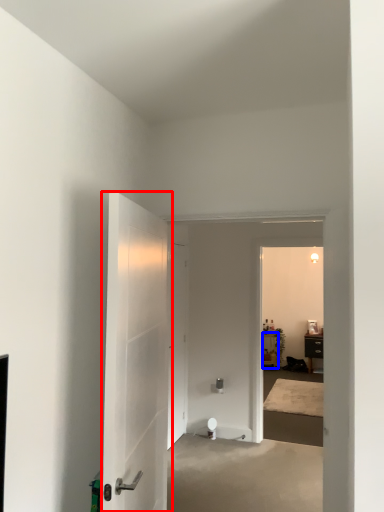
Question: Among these objects, which one is nearest to the camera, door (highlighted by a red box) or furniture (highlighted by a blue box)?

Choices:
 (A) door
 (B) furniture

Answer: (A)